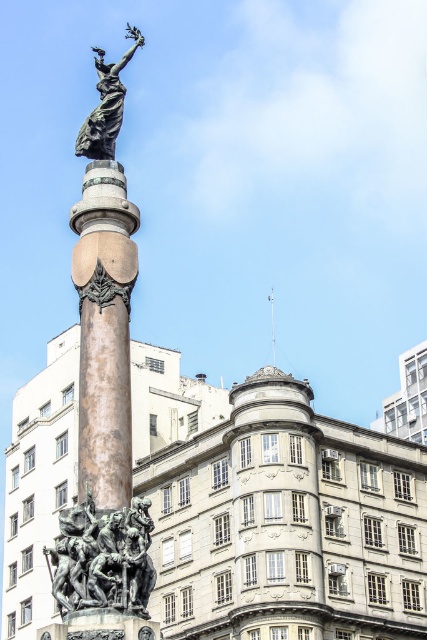
Can you confirm if bronze statue at center is bigger than bronze/brass statue at lower left?

Yes, bronze statue at center is bigger than bronze/brass statue at lower left.

This screenshot has width=427, height=640. Find the location of `bronze statue at center`. bronze statue at center is located at coordinates (104, 400).

At what (x,y) coordinates should I click in order to perform the action: click on bronze statue at center. Please return your answer as a coordinate pair (x, y). The image size is (427, 640). Looking at the image, I should click on (104, 400).

Which is above, bronze statue at center or bronze column at center?

bronze statue at center is higher up.

Between point (58, 636) and point (111, 164), which one is positioned behind?

The point (111, 164) is more distant.

You are a GUI agent. You are given a task and a screenshot of the screen. Output one action in this format:
    pyautogui.click(x=<x>, y=<y>)
    Task: Click on the bronze statue at center
    The width and height of the screenshot is (427, 640).
    Given the screenshot: What is the action you would take?
    pyautogui.click(x=104, y=400)

Find the location of a particular element. This screenshot has height=640, width=427. bronze statue at center is located at coordinates (104, 400).

Does point (56, 579) lie behind point (125, 61)?

No, (56, 579) is closer to viewer.

Which is in front, point (145, 557) or point (99, 67)?

Point (145, 557) is in front.

This screenshot has width=427, height=640. What are the coordinates of `bronze/brass statue at lower left` in the screenshot? It's located at (102, 560).

Identify the location of bronze/brass statue at lower left. The width and height of the screenshot is (427, 640). (102, 560).